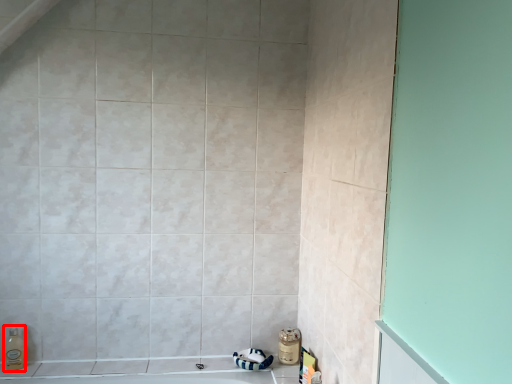
Question: Where is soap dispenser (annotated by the red box) located in relation to toiletry in the image?

Choices:
 (A) right
 (B) left

Answer: (B)